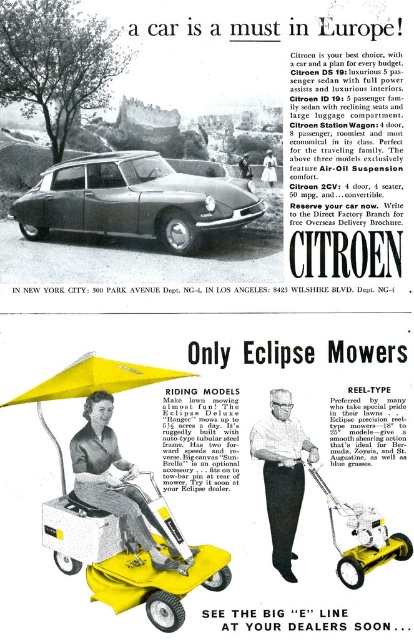
Can you confirm if white fabric riding mower at center is positioned above yellow plastic mower at lower right?

Indeed, white fabric riding mower at center is positioned over yellow plastic mower at lower right.

Is white fabric riding mower at center taller than yellow plastic mower at lower right?

Yes.

Does point (284, 474) come farther from viewer compared to point (380, 541)?

Yes, it is behind point (380, 541).

This screenshot has width=414, height=640. Find the location of `white fabric riding mower at center`. white fabric riding mower at center is located at coordinates (281, 474).

Is point (113, 164) closer to viewer compared to point (36, 394)?

No.

Which is in front, point (41, 205) or point (96, 385)?

Point (96, 385) is in front.

Locate an element on the screen. The image size is (414, 640). matte silver car at center is located at coordinates (134, 202).

Is matte silver car at center to the right of yellow fabric riding mower at lower left from the viewer's perspective?

Indeed, matte silver car at center is positioned on the right side of yellow fabric riding mower at lower left.

Does matte silver car at center appear under yellow fabric riding mower at lower left?

No, matte silver car at center is not below yellow fabric riding mower at lower left.

Who is more distant from viewer, (127,200) or (103,451)?

The point (127,200) is behind.

Locate an element on the screen. Image resolution: width=414 pixels, height=640 pixels. matte silver car at center is located at coordinates (134, 202).